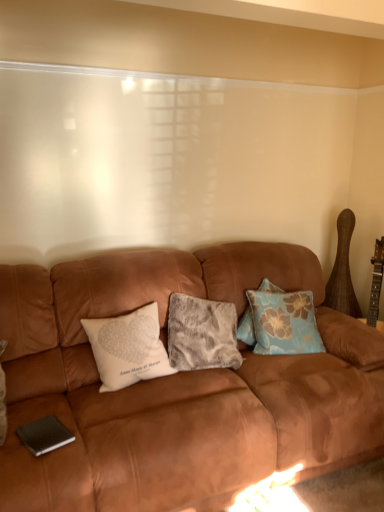
Question: Is blue floral fabric pillow at center, which is counted as the 1th pillow, starting from the right, at the right side of fuzzy gray pillow at center, marked as the 2th pillow in a left-to-right arrangement?

Choices:
 (A) no
 (B) yes

Answer: (B)

Question: Considering the relative sizes of blue floral fabric pillow at center, which is counted as the 1th pillow, starting from the right, and fuzzy gray pillow at center, marked as the 2th pillow in a left-to-right arrangement, in the image provided, is blue floral fabric pillow at center, which is counted as the 1th pillow, starting from the right, shorter than fuzzy gray pillow at center, marked as the 2th pillow in a left-to-right arrangement,?

Choices:
 (A) no
 (B) yes

Answer: (B)

Question: Can fuzzy gray pillow at center, which is counted as the second pillow, starting from the right, be found inside blue floral fabric pillow at center, which is counted as the 1th pillow, starting from the right?

Choices:
 (A) no
 (B) yes

Answer: (A)

Question: From a real-world perspective, is blue floral fabric pillow at center, which is counted as the third pillow, starting from the left, positioned over fuzzy gray pillow at center, which is counted as the second pillow, starting from the right, based on gravity?

Choices:
 (A) yes
 (B) no

Answer: (A)

Question: Is blue floral fabric pillow at center, which is counted as the 1th pillow, starting from the right, facing towards fuzzy gray pillow at center, marked as the 2th pillow in a left-to-right arrangement?

Choices:
 (A) no
 (B) yes

Answer: (A)

Question: From the image's perspective, is fuzzy gray pillow at center, marked as the 2th pillow in a left-to-right arrangement, located above or below blue floral fabric pillow at center, which is counted as the 1th pillow, starting from the right?

Choices:
 (A) above
 (B) below

Answer: (B)

Question: From their relative heights in the image, would you say fuzzy gray pillow at center, marked as the 2th pillow in a left-to-right arrangement, is taller or shorter than blue floral fabric pillow at center, which is counted as the 1th pillow, starting from the right?

Choices:
 (A) tall
 (B) short

Answer: (A)

Question: In terms of size, does fuzzy gray pillow at center, which is counted as the second pillow, starting from the right, appear bigger or smaller than blue floral fabric pillow at center, which is counted as the 1th pillow, starting from the right?

Choices:
 (A) small
 (B) big

Answer: (B)

Question: Does point (218, 335) appear closer or farther from the camera than point (291, 308)?

Choices:
 (A) closer
 (B) farther

Answer: (A)

Question: In terms of width, does blue floral fabric pillow at center, which is counted as the 1th pillow, starting from the right, look wider or thinner when compared to white printed pillow at center, marked as the 1th pillow in a left-to-right arrangement?

Choices:
 (A) thin
 (B) wide

Answer: (A)

Question: Considering the positions of blue floral fabric pillow at center, which is counted as the 1th pillow, starting from the right, and white printed pillow at center, the third pillow when ordered from right to left, in the image, is blue floral fabric pillow at center, which is counted as the 1th pillow, starting from the right, taller or shorter than white printed pillow at center, the third pillow when ordered from right to left,?

Choices:
 (A) tall
 (B) short

Answer: (A)

Question: Is blue floral fabric pillow at center, which is counted as the 1th pillow, starting from the right, to the left or to the right of white printed pillow at center, marked as the 1th pillow in a left-to-right arrangement, in the image?

Choices:
 (A) left
 (B) right

Answer: (B)

Question: From the image's perspective, is blue floral fabric pillow at center, which is counted as the third pillow, starting from the left, positioned above or below white printed pillow at center, marked as the 1th pillow in a left-to-right arrangement?

Choices:
 (A) below
 (B) above

Answer: (B)

Question: Relative to suede brown couch at center, is blue floral fabric pillow at center, which is counted as the 1th pillow, starting from the right, in front or behind?

Choices:
 (A) front
 (B) behind

Answer: (B)

Question: From the image's perspective, is blue floral fabric pillow at center, which is counted as the third pillow, starting from the left, positioned above or below suede brown couch at center?

Choices:
 (A) below
 (B) above

Answer: (B)